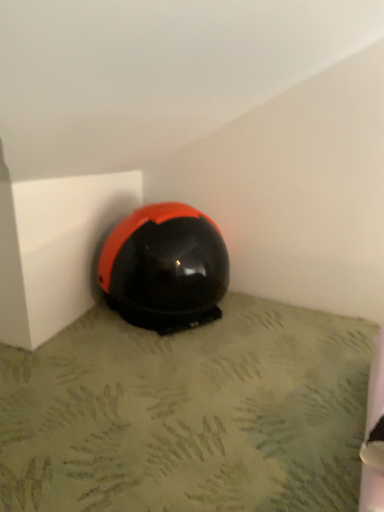
Measure the distance between point (x=150, y=384) and camera.

A distance of 1.26 meters exists between point (x=150, y=384) and camera.

You are a GUI agent. You are given a task and a screenshot of the screen. Output one action in this format:
    pyautogui.click(x=<x>, y=<y>)
    Task: Click on the black matte helmet at center
    The width and height of the screenshot is (384, 512).
    Given the screenshot: What is the action you would take?
    pyautogui.click(x=188, y=414)

What do you see at coordinates (188, 414) in the screenshot? Image resolution: width=384 pixels, height=512 pixels. I see `black matte helmet at center` at bounding box center [188, 414].

What is the approximate height of black matte helmet at center?

1.83 inches.

The image size is (384, 512). In order to click on glossy black helmet at lower center in this screenshot , I will do `click(165, 268)`.

Describe the element at coordinates (165, 268) in the screenshot. This screenshot has height=512, width=384. I see `glossy black helmet at lower center` at that location.

Where is `black matte helmet at center`? The height and width of the screenshot is (512, 384). black matte helmet at center is located at coordinates (188, 414).

Which is more to the right, glossy black helmet at lower center or black matte helmet at center?

Positioned to the right is black matte helmet at center.

Relative to black matte helmet at center, is glossy black helmet at lower center in front or behind?

In the image, glossy black helmet at lower center appears behind black matte helmet at center.

Is point (167, 222) positioned after point (36, 452)?

Yes, it is.

From the image's perspective, relative to black matte helmet at center, is glossy black helmet at lower center above or below?

Clearly, from the image's perspective, glossy black helmet at lower center is above black matte helmet at center.

From a real-world perspective, who is located lower, glossy black helmet at lower center or black matte helmet at center?

black matte helmet at center, from a real-world perspective.

Looking at their sizes, would you say glossy black helmet at lower center is wider or thinner than black matte helmet at center?

In the image, glossy black helmet at lower center appears to be more narrow than black matte helmet at center.

Considering the sizes of glossy black helmet at lower center and black matte helmet at center in the image, is glossy black helmet at lower center taller or shorter than black matte helmet at center?

glossy black helmet at lower center is taller than black matte helmet at center.

Considering the sizes of objects glossy black helmet at lower center and black matte helmet at center in the image provided, who is smaller, glossy black helmet at lower center or black matte helmet at center?

With smaller size is black matte helmet at center.

Is black matte helmet at center completely or partially inside glossy black helmet at lower center?

No, black matte helmet at center is not surrounded by glossy black helmet at lower center.

Is glossy black helmet at lower center next to black matte helmet at center and touching it?

glossy black helmet at lower center is not next to black matte helmet at center, and they're not touching.

Is glossy black helmet at lower center aimed at black matte helmet at center?

No, glossy black helmet at lower center is not oriented towards black matte helmet at center.

How many degrees apart are the facing directions of glossy black helmet at lower center and black matte helmet at center?

They differ by 1.06 degrees in their facing directions.

Image resolution: width=384 pixels, height=512 pixels. In the image, there is a glossy black helmet at lower center. Find the location of `concrete below it (from the image's perspective)`. concrete below it (from the image's perspective) is located at coordinates (188, 414).

Considering the relative positions of black matte helmet at center and glossy black helmet at lower center in the image provided, is black matte helmet at center to the right of glossy black helmet at lower center from the viewer's perspective?

Yes.

Which is in front, black matte helmet at center or glossy black helmet at lower center?

black matte helmet at center.

Is point (91, 384) farther from viewer compared to point (127, 277)?

No, (91, 384) is in front of (127, 277).

Based on the photo, from the image's perspective, is black matte helmet at center below glossy black helmet at lower center?

Indeed, from the image's perspective, black matte helmet at center is shown beneath glossy black helmet at lower center.

From a real-world perspective, which is physically below, black matte helmet at center or glossy black helmet at lower center?

In real-world perspective, black matte helmet at center is lower.

Is black matte helmet at center wider or thinner than glossy black helmet at lower center?

Clearly, black matte helmet at center has more width compared to glossy black helmet at lower center.

Can you confirm if black matte helmet at center is taller than glossy black helmet at lower center?

No, black matte helmet at center is not taller than glossy black helmet at lower center.

Who is smaller, black matte helmet at center or glossy black helmet at lower center?

black matte helmet at center is smaller.

Would you say black matte helmet at center is inside or outside glossy black helmet at lower center?

black matte helmet at center cannot be found inside glossy black helmet at lower center.

Are black matte helmet at center and glossy black helmet at lower center beside each other?

No, black matte helmet at center is not beside glossy black helmet at lower center.

Is black matte helmet at center positioned with its back to glossy black helmet at lower center?

black matte helmet at center is not turned away from glossy black helmet at lower center.

How distant is black matte helmet at center from glossy black helmet at lower center?

12.01 inches.

Locate an element on the screen. This screenshot has width=384, height=512. concrete located in front of the glossy black helmet at lower center is located at coordinates (188, 414).

I want to click on concrete beneath the glossy black helmet at lower center (from a real-world perspective), so click(188, 414).

Identify the location of helmet to the left of black matte helmet at center. The width and height of the screenshot is (384, 512). (165, 268).